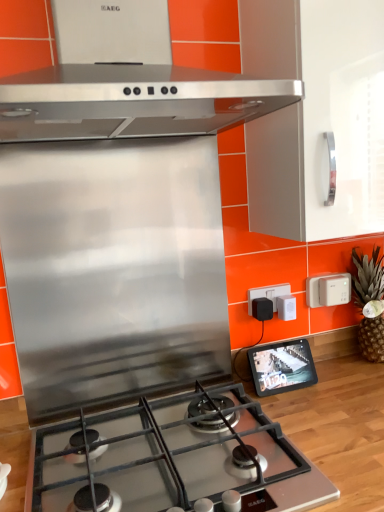
I want to click on black glossy tablet at right, so [x=282, y=367].

Describe the element at coordinates (367, 278) in the screenshot. I see `green textured pineapple at right` at that location.

From the picture: What is the approximate height of green textured pineapple at right?

It is 36.77 centimeters.

What do you see at coordinates (171, 458) in the screenshot? I see `stainless steel gas stove at center` at bounding box center [171, 458].

This screenshot has width=384, height=512. I want to click on white plastic electric outlet at upper right, the 1th electric outlet positioned from the right, so click(x=328, y=290).

Where is `stainless steel range hood at upper center`? stainless steel range hood at upper center is located at coordinates (133, 101).

From a real-world perspective, between green textured pineapple at right and black glossy tablet at right, who is vertically higher?

green textured pineapple at right, from a real-world perspective.

Does point (370, 335) come farther from viewer compared to point (280, 361)?

Yes.

Is green textured pineapple at right oriented away from black glossy tablet at right?

green textured pineapple at right does not have its back to black glossy tablet at right.

Which object is more forward, green textured pineapple at right or black glossy tablet at right?

black glossy tablet at right is more forward.

Based on their sizes in the image, would you say black plastic at upper right, placed as the first electric outlet when sorted from left to right, is bigger or smaller than stainless steel range hood at upper center?

black plastic at upper right, placed as the first electric outlet when sorted from left to right, is smaller than stainless steel range hood at upper center.

Measure the distance from black plastic at upper right, placed as the first electric outlet when sorted from left to right, to stainless steel range hood at upper center.

The distance of black plastic at upper right, placed as the first electric outlet when sorted from left to right, from stainless steel range hood at upper center is 26.87 inches.

Which is more to the right, black plastic at upper right, placed as the first electric outlet when sorted from left to right, or stainless steel range hood at upper center?

Positioned to the right is black plastic at upper right, placed as the first electric outlet when sorted from left to right.

How far apart are stainless steel gas stove at center and black glossy tablet at right?

stainless steel gas stove at center and black glossy tablet at right are 12.81 inches apart from each other.

From a real-world perspective, is stainless steel gas stove at center over black glossy tablet at right?

No, from a real-world perspective, stainless steel gas stove at center is not over black glossy tablet at right

From the image's perspective, is stainless steel gas stove at center under black glossy tablet at right?

Yes, from the image's perspective, stainless steel gas stove at center is below black glossy tablet at right.

Which is in front, stainless steel gas stove at center or black glossy tablet at right?

stainless steel gas stove at center.

Is stainless steel range hood at upper center turned away from green textured pineapple at right?

No, stainless steel range hood at upper center's orientation is not away from green textured pineapple at right.

In the scene shown: Who is smaller, stainless steel range hood at upper center or green textured pineapple at right?

Smaller between the two is green textured pineapple at right.

Is point (6, 111) positioned behind point (361, 321)?

No.

Which is nearer, (372, 258) or (218, 83)?

The point (218, 83) is in front.

Is green textured pineapple at right located outside stainless steel range hood at upper center?

Yes, green textured pineapple at right is not within stainless steel range hood at upper center.

This screenshot has height=512, width=384. I want to click on pineapple below the stainless steel range hood at upper center (from a real-world perspective), so click(x=367, y=278).

Considering the relative sizes of black glossy tablet at right and white plastic electric outlet at upper right, the second electric outlet when ordered from left to right, in the image provided, is black glossy tablet at right thinner than white plastic electric outlet at upper right, the second electric outlet when ordered from left to right,?

In fact, black glossy tablet at right might be wider than white plastic electric outlet at upper right, the second electric outlet when ordered from left to right.

In the scene shown: Considering the sizes of objects black glossy tablet at right and white plastic electric outlet at upper right, the 1th electric outlet positioned from the right, in the image provided, who is bigger, black glossy tablet at right or white plastic electric outlet at upper right, the 1th electric outlet positioned from the right,?

Bigger between the two is black glossy tablet at right.

Considering the relative positions of black glossy tablet at right and white plastic electric outlet at upper right, the 1th electric outlet positioned from the right, in the image provided, is black glossy tablet at right behind white plastic electric outlet at upper right, the 1th electric outlet positioned from the right,?

No, black glossy tablet at right is closer to the viewer.

Can you confirm if black glossy tablet at right is shorter than white plastic electric outlet at upper right, the 1th electric outlet positioned from the right?

Incorrect, the height of black glossy tablet at right does not fall short of that of white plastic electric outlet at upper right, the 1th electric outlet positioned from the right.

From a real-world perspective, who is located lower, white plastic electric outlet at upper right, the second electric outlet when ordered from left to right, or stainless steel range hood at upper center?

white plastic electric outlet at upper right, the second electric outlet when ordered from left to right, is physically lower.

Could you tell me if white plastic electric outlet at upper right, the second electric outlet when ordered from left to right, is turned towards stainless steel range hood at upper center?

No, white plastic electric outlet at upper right, the second electric outlet when ordered from left to right, is not facing towards stainless steel range hood at upper center.

Is white plastic electric outlet at upper right, the 1th electric outlet positioned from the right, touching stainless steel range hood at upper center?

No, white plastic electric outlet at upper right, the 1th electric outlet positioned from the right, is not making contact with stainless steel range hood at upper center.

Would you say white plastic electric outlet at upper right, the second electric outlet when ordered from left to right, is to the left or to the right of stainless steel range hood at upper center in the picture?

In the image, white plastic electric outlet at upper right, the second electric outlet when ordered from left to right, appears on the right side of stainless steel range hood at upper center.

Locate an element on the screen. Image resolution: width=384 pixels, height=512 pixels. pineapple on the right of black glossy tablet at right is located at coordinates (367, 278).

In the image, there is a black plastic at upper right, the second electric outlet in the right-to-left sequence. At what (x,y) coordinates should I click in order to perform the action: click on home appliance above it (from the image's perspective). Please return your answer as a coordinate pair (x, y). Looking at the image, I should click on (133, 101).

From the image, which object appears to be farther from white plastic electric outlet at upper right, the 1th electric outlet positioned from the right, stainless steel gas stove at center or black plastic at upper right, placed as the first electric outlet when sorted from left to right?

stainless steel gas stove at center is positioned further to the anchor white plastic electric outlet at upper right, the 1th electric outlet positioned from the right.

Looking at the image, which one is located further to stainless steel gas stove at center, black glossy tablet at right or black plastic at upper right, the second electric outlet in the right-to-left sequence?

black plastic at upper right, the second electric outlet in the right-to-left sequence.

When comparing their distances from black plastic at upper right, the second electric outlet in the right-to-left sequence, does white plastic electric outlet at upper right, the 1th electric outlet positioned from the right, or stainless steel range hood at upper center seem closer?

Based on the image, white plastic electric outlet at upper right, the 1th electric outlet positioned from the right, appears to be nearer to black plastic at upper right, the second electric outlet in the right-to-left sequence.

Based on their spatial positions, is white plastic electric outlet at upper right, the second electric outlet when ordered from left to right, or stainless steel gas stove at center further from black plastic at upper right, the second electric outlet in the right-to-left sequence?

stainless steel gas stove at center.

Considering their positions, is white plastic electric outlet at upper right, the 1th electric outlet positioned from the right, positioned further to black glossy tablet at right than stainless steel gas stove at center?

stainless steel gas stove at center is further to black glossy tablet at right.

Which object lies nearer to the anchor point black plastic at upper right, the second electric outlet in the right-to-left sequence, green textured pineapple at right or stainless steel range hood at upper center?

Among the two, green textured pineapple at right is located nearer to black plastic at upper right, the second electric outlet in the right-to-left sequence.

When comparing their distances from stainless steel gas stove at center, does black glossy tablet at right or stainless steel range hood at upper center seem closer?

Based on the image, black glossy tablet at right appears to be nearer to stainless steel gas stove at center.

Estimate the real-world distances between objects in this image. Which object is further from black plastic at upper right, the second electric outlet in the right-to-left sequence, black glossy tablet at right or white plastic electric outlet at upper right, the 1th electric outlet positioned from the right?

Based on the image, black glossy tablet at right appears to be further to black plastic at upper right, the second electric outlet in the right-to-left sequence.

At what (x,y) coordinates should I click in order to perform the action: click on pineapple located between stainless steel range hood at upper center and white plastic electric outlet at upper right, the 1th electric outlet positioned from the right, in the depth direction. Please return your answer as a coordinate pair (x, y). This screenshot has height=512, width=384. Looking at the image, I should click on (367, 278).

I want to click on appliance positioned between stainless steel gas stove at center and green textured pineapple at right from near to far, so click(282, 367).

Where is `appliance positioned between stainless steel gas stove at center and black plastic at upper right, placed as the first electric outlet when sorted from left to right, from near to far`? The height and width of the screenshot is (512, 384). appliance positioned between stainless steel gas stove at center and black plastic at upper right, placed as the first electric outlet when sorted from left to right, from near to far is located at coordinates (282, 367).

Image resolution: width=384 pixels, height=512 pixels. Identify the location of appliance between black plastic at upper right, placed as the first electric outlet when sorted from left to right, and green textured pineapple at right. (282, 367).